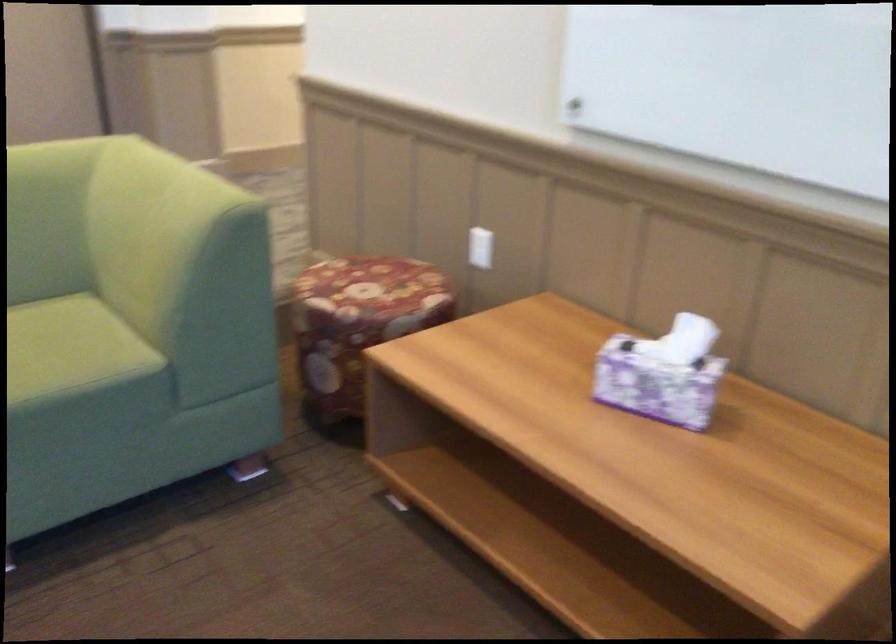
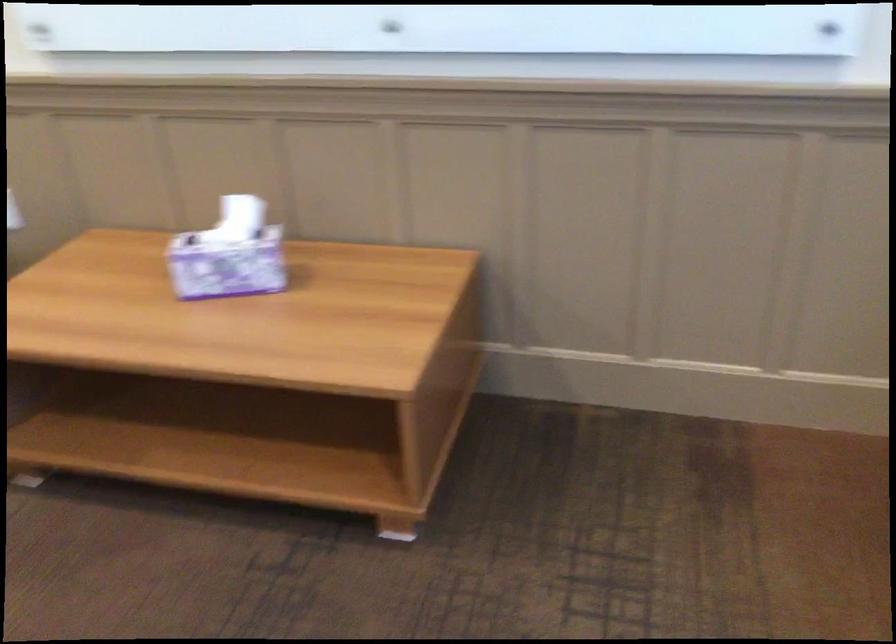
Question: The first image is from the beginning of the video and the second image is from the end. How did the camera likely rotate when shooting the video?

Choices:
 (A) Left
 (B) Right
 (C) Up
 (D) Down

Answer: (B)